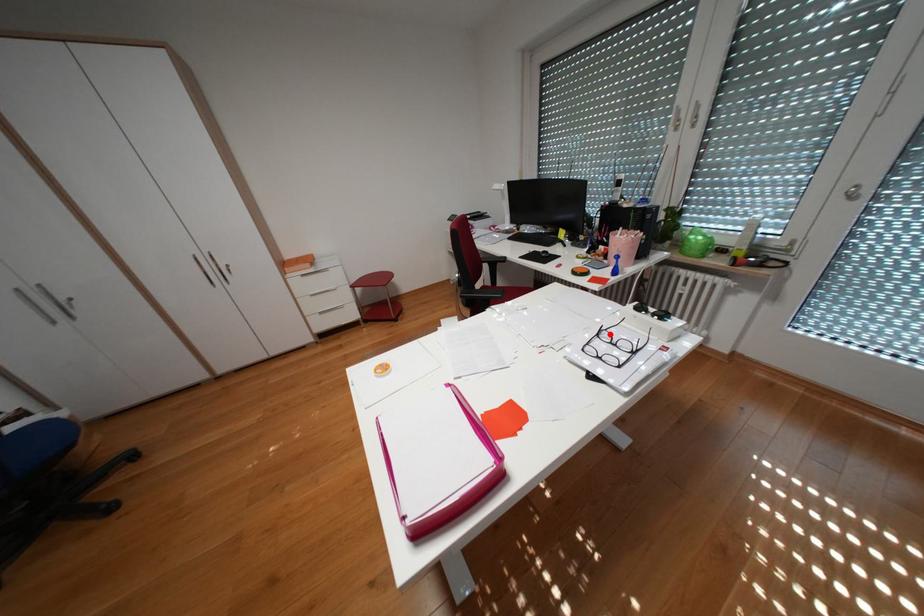
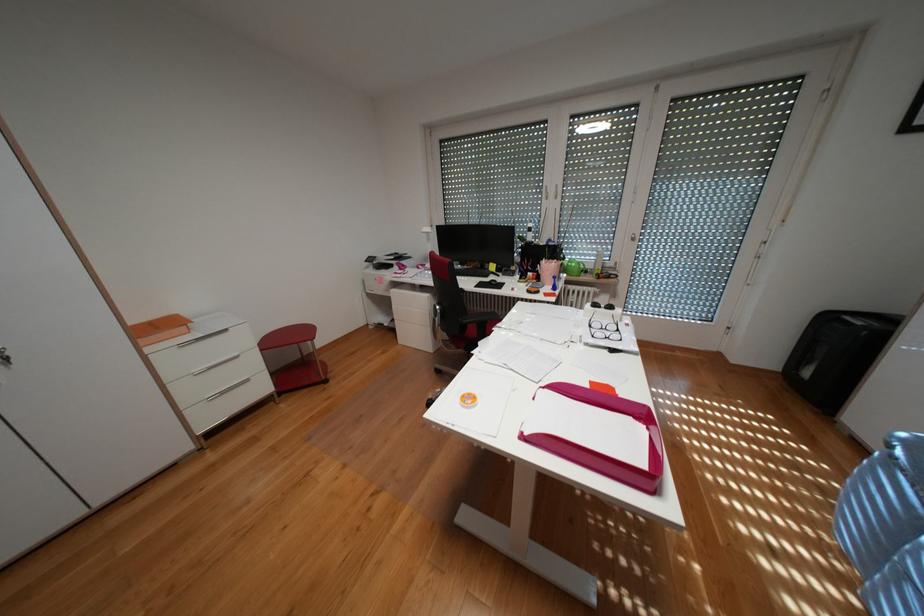
Where in the second image is the point corresponding to the highlighted location from the first image?

(602, 325)